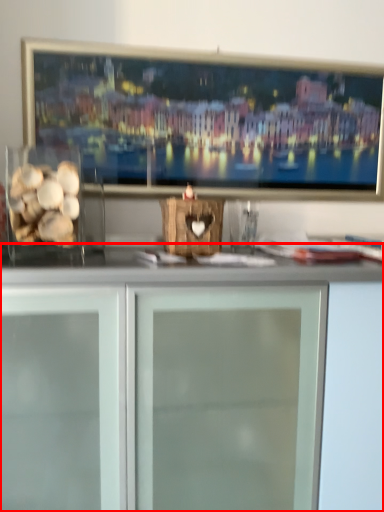
Question: From the image, what is the correct spatial relationship of cabinetry (annotated by the red box) in relation to food?

Choices:
 (A) left
 (B) right

Answer: (B)